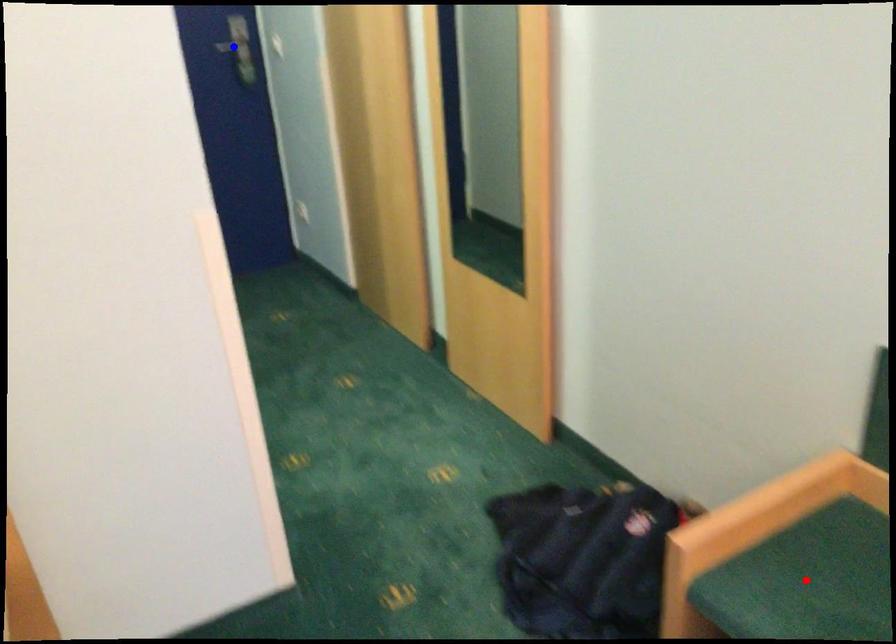
Question: Two points are marked on the image. Which point is closer to the camera?

Choices:
 (A) Blue point is closer.
 (B) Red point is closer.

Answer: (B)